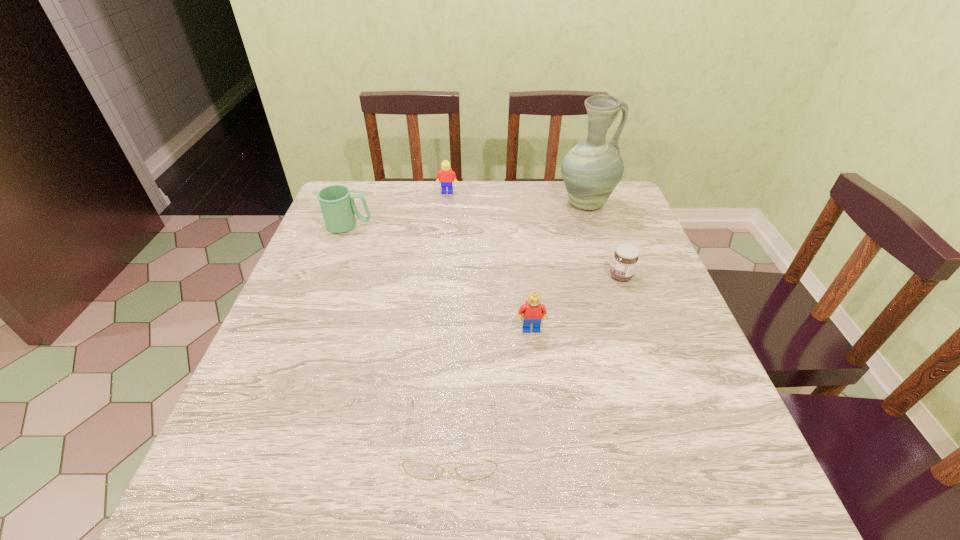
The image size is (960, 540). Find the location of `vacant space that's between the fourth farthest object and the left Lego`. vacant space that's between the fourth farthest object and the left Lego is located at coordinates (534, 234).

Where is `free space between the pitcher and the shortest object`? free space between the pitcher and the shortest object is located at coordinates (519, 322).

The width and height of the screenshot is (960, 540). Identify the location of empty location between the leftmost object and the nearest object. (400, 333).

At what (x,y) coordinates should I click in order to perform the action: click on free space that is in between the mug and the pitcher. Please return your answer as a coordinate pair (x, y). Looking at the image, I should click on (468, 215).

You are a GUI agent. You are given a task and a screenshot of the screen. Output one action in this format:
    pyautogui.click(x=<x>, y=<y>)
    Task: Click on the blank region between the right Lego and the spectacles
    The image size is (960, 540).
    Given the screenshot: What is the action you would take?
    pyautogui.click(x=492, y=384)

The height and width of the screenshot is (540, 960). In order to click on vacant space that's between the nearest object and the fourth object from left to right in this screenshot , I will do `click(492, 384)`.

This screenshot has width=960, height=540. In order to click on unoccupied position between the fourth object from left to right and the pitcher in this screenshot , I will do `click(559, 266)`.

Where is `vacant region between the mug and the third object from right to left`? This screenshot has height=540, width=960. vacant region between the mug and the third object from right to left is located at coordinates (440, 277).

Locate which object is the fifth closest to the left Lego. Please provide its 2D coordinates. Your answer should be formatted as a tuple, i.e. [(x, y)], where the tuple contains the x and y coordinates of a point satisfying the conditions above.

[(480, 470)]

Locate an element on the screen. the second closest object to the mug is located at coordinates (533, 311).